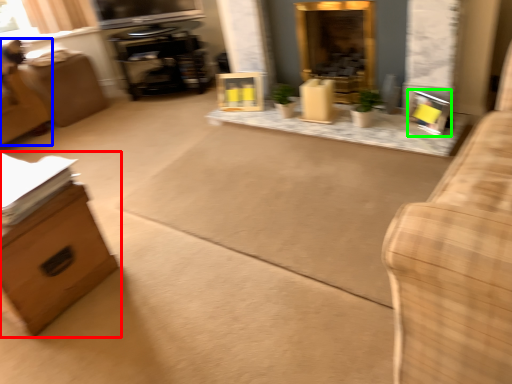
Question: Which object is the farthest from furniture (highlighted by a red box)? Choose among these: swivel chair (highlighted by a blue box) or picture frame (highlighted by a green box).

Choices:
 (A) swivel chair
 (B) picture frame

Answer: (B)